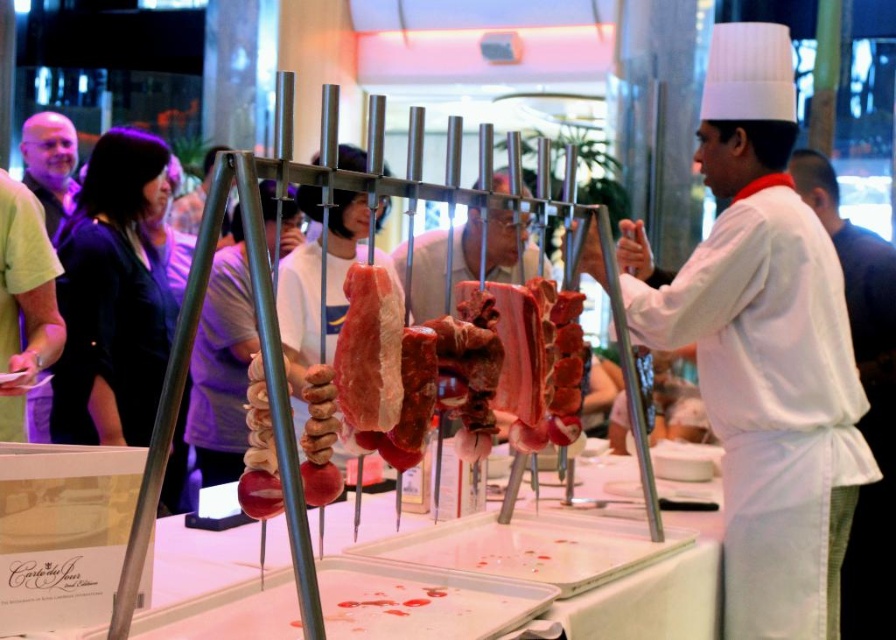
Is raw meat at center to the left of pink raw meat at center from the viewer's perspective?

No, raw meat at center is not to the left of pink raw meat at center.

This screenshot has height=640, width=896. What do you see at coordinates (438, 266) in the screenshot? I see `raw meat at center` at bounding box center [438, 266].

Is point (513, 269) behind point (386, 352)?

Yes, point (513, 269) is farther from viewer.

This screenshot has height=640, width=896. I want to click on raw meat at center, so click(x=438, y=266).

Is white chef's uniform at center shorter than pink raw meat at center?

No.

Between point (757, 198) and point (336, 384), which one is positioned in front?

Point (336, 384)

I want to click on white chef's uniform at center, so click(765, 349).

Which is more to the left, white chef's uniform at center or raw meat at center?

From the viewer's perspective, raw meat at center appears more on the left side.

Which is behind, point (702, 326) or point (412, 275)?

The point (412, 275) is more distant.

I want to click on white chef's uniform at center, so click(x=765, y=349).